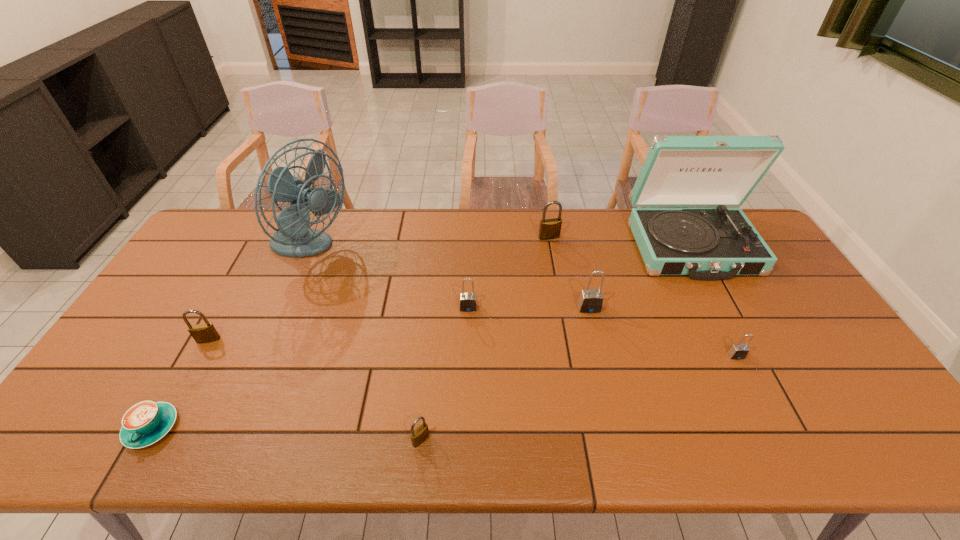
Locate an element on the screen. This screenshot has width=960, height=540. the rightmost padlock is located at coordinates (739, 351).

You are a GUI agent. You are given a task and a screenshot of the screen. Output one action in this format:
    pyautogui.click(x=<x>, y=<y>)
    Task: Click on the smallest gray padlock
    
    Given the screenshot: What is the action you would take?
    coord(739,351)

The height and width of the screenshot is (540, 960). I want to click on the smallest brass padlock, so click(418, 436).

This screenshot has width=960, height=540. I want to click on the nearest padlock, so click(418, 436).

Where is `cappuccino`? cappuccino is located at coordinates (146, 422).

Where is `turquoise cappuccino`? Image resolution: width=960 pixels, height=540 pixels. turquoise cappuccino is located at coordinates (146, 422).

At what (x,y) coordinates should I click in order to perform the action: click on vacant space located in front of the fan to blow air. Please return your answer as a coordinate pair (x, y). This screenshot has height=540, width=960. Looking at the image, I should click on (416, 249).

This screenshot has height=540, width=960. Find the location of `blank area located 0.210m on the face side of the record player`. blank area located 0.210m on the face side of the record player is located at coordinates (740, 336).

Locate an element on the screen. free space located 0.250m on the front of the farthest padlock is located at coordinates (559, 293).

At what (x,y) coordinates should I click in order to perform the action: click on blank space located on the shackle of the seventh object from left to right. Please return your answer as a coordinate pair (x, y). Image resolution: width=960 pixels, height=540 pixels. Looking at the image, I should click on (596, 335).